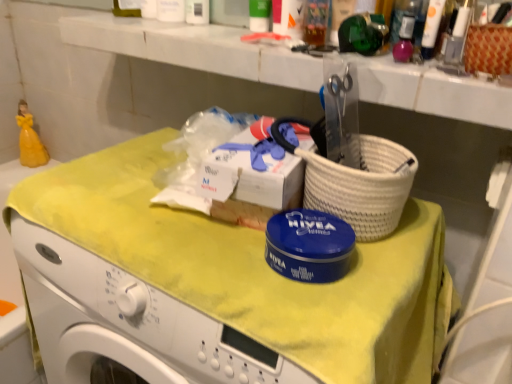
The width and height of the screenshot is (512, 384). Find the location of `white plastic container at upper center, which is counted as the first toiletry, starting from the back`. white plastic container at upper center, which is counted as the first toiletry, starting from the back is located at coordinates (197, 12).

The width and height of the screenshot is (512, 384). What do you see at coordinates (194, 48) in the screenshot?
I see `white glossy counter top at upper center` at bounding box center [194, 48].

Find the location of `white plastic container at upper center, placed as the 3th toiletry when sorted from front to back`. white plastic container at upper center, placed as the 3th toiletry when sorted from front to back is located at coordinates (197, 12).

Could you tell me if white glossy counter top at upper center is facing translucent plastic cup at upper center, the 2th toiletry viewed from the left?

No, white glossy counter top at upper center is not facing towards translucent plastic cup at upper center, the 2th toiletry viewed from the left.

Between point (118, 35) and point (326, 6), which one is positioned in front?

The point (326, 6) is in front.

Does white glossy counter top at upper center have a greater height compared to translucent plastic cup at upper center, the 2th toiletry viewed from the left?

No.

Considering the relative sizes of woven brown basket at upper right and white glossy tube at upper right, the 1th toiletry when ordered from right to left, in the image provided, is woven brown basket at upper right bigger than white glossy tube at upper right, the 1th toiletry when ordered from right to left,?

Correct, woven brown basket at upper right is larger in size than white glossy tube at upper right, the 1th toiletry when ordered from right to left.

How far apart are woven brown basket at upper right and white glossy tube at upper right, acting as the first toiletry starting from the front?

The distance of woven brown basket at upper right from white glossy tube at upper right, acting as the first toiletry starting from the front, is 3.56 inches.

Is woven brown basket at upper right far from white glossy tube at upper right, the 1th toiletry when ordered from right to left?

That's not correct — woven brown basket at upper right is a little close to white glossy tube at upper right, the 1th toiletry when ordered from right to left.

From the image's perspective, which toiletry is the 1st one above the woven brown basket at upper right? Please provide its 2D coordinates.

[(431, 27)]

Does white glossy tube at upper right, the 3th toiletry in the left-to-right sequence, come in front of woven brown basket at upper right?

No.

From a real-world perspective, which object stands above the other?

In real-world perspective, woven brown basket at upper right is above.

Can you confirm if white glossy tube at upper right, acting as the first toiletry starting from the front, is taller than woven brown basket at upper right?

Incorrect, the height of white glossy tube at upper right, acting as the first toiletry starting from the front, is not larger of that of woven brown basket at upper right.

Could you measure the distance between white glossy tube at upper right, acting as the first toiletry starting from the front, and woven brown basket at upper right?

3.56 inches.

Is yellow fabric at center taller or shorter than white glossy tube at upper right, which is counted as the 3th toiletry, starting from the back?

yellow fabric at center is taller than white glossy tube at upper right, which is counted as the 3th toiletry, starting from the back.

Does yellow fabric at center appear on the left side of white glossy tube at upper right, which is counted as the 3th toiletry, starting from the back?

Correct, you'll find yellow fabric at center to the left of white glossy tube at upper right, which is counted as the 3th toiletry, starting from the back.

From the image's perspective, is yellow fabric at center located above white glossy tube at upper right, the 3th toiletry in the left-to-right sequence?

Incorrect, from the image's perspective, yellow fabric at center is lower than white glossy tube at upper right, the 3th toiletry in the left-to-right sequence.

From the picture: How much distance is there between yellow fabric at center and white glossy tube at upper right, the 1th toiletry when ordered from right to left?

yellow fabric at center and white glossy tube at upper right, the 1th toiletry when ordered from right to left, are 45.28 centimeters apart from each other.

Is yellow fabric at center positioned beyond the bounds of white plastic container at upper center, marked as the first toiletry in a left-to-right arrangement?

Indeed, yellow fabric at center is completely outside white plastic container at upper center, marked as the first toiletry in a left-to-right arrangement.

Considering the positions of objects yellow fabric at center and white plastic container at upper center, marked as the first toiletry in a left-to-right arrangement, in the image provided, who is behind, yellow fabric at center or white plastic container at upper center, marked as the first toiletry in a left-to-right arrangement,?

white plastic container at upper center, marked as the first toiletry in a left-to-right arrangement, is behind.

Between yellow fabric at center and white plastic container at upper center, which is counted as the first toiletry, starting from the back, which one has smaller size?

Smaller between the two is white plastic container at upper center, which is counted as the first toiletry, starting from the back.

Considering the points (110, 211) and (193, 3), which point is in front, point (110, 211) or point (193, 3)?

Positioned in front is point (110, 211).

Between white glossy counter top at upper center and white glossy tube at upper right, the 3th toiletry in the left-to-right sequence, which one is positioned in front?

white glossy counter top at upper center.

From the image's perspective, would you say white glossy counter top at upper center is shown under white glossy tube at upper right, acting as the first toiletry starting from the front?

Incorrect, from the image's perspective, white glossy counter top at upper center is higher than white glossy tube at upper right, acting as the first toiletry starting from the front.

From a real-world perspective, is white glossy counter top at upper center beneath white glossy tube at upper right, which is counted as the 3th toiletry, starting from the back?

Yes.

Is white glossy counter top at upper center next to white glossy tube at upper right, the 3th toiletry in the left-to-right sequence?

No, white glossy counter top at upper center is not in contact with white glossy tube at upper right, the 3th toiletry in the left-to-right sequence.

Is point (315, 23) positioned after point (69, 33)?

No, it is not.

Is translucent plastic cup at upper center, the 2th toiletry in the front-to-back sequence, positioned in front of white glossy counter top at upper center?

That is False.

Is translucent plastic cup at upper center, the second toiletry viewed from the right, thinner than white glossy counter top at upper center?

Correct, the width of translucent plastic cup at upper center, the second toiletry viewed from the right, is less than that of white glossy counter top at upper center.

Considering the relative sizes of translucent plastic cup at upper center, which ranks as the second toiletry in back-to-front order, and white glossy counter top at upper center in the image provided, is translucent plastic cup at upper center, which ranks as the second toiletry in back-to-front order, bigger than white glossy counter top at upper center?

No, translucent plastic cup at upper center, which ranks as the second toiletry in back-to-front order, is not bigger than white glossy counter top at upper center.

Identify the location of counter top below the translucent plastic cup at upper center, which ranks as the second toiletry in back-to-front order (from the image's perspective). (194, 48).

Where is `basket in front of the white glossy tube at upper right, the 1th toiletry when ordered from right to left`? basket in front of the white glossy tube at upper right, the 1th toiletry when ordered from right to left is located at coordinates (488, 49).

Estimate the real-world distances between objects in this image. Which object is further from translucent plastic cup at upper center, the 2th toiletry in the front-to-back sequence, woven brown basket at upper right or white plastic container at upper center, which appears as the 3th toiletry when viewed from the right?

woven brown basket at upper right lies further to translucent plastic cup at upper center, the 2th toiletry in the front-to-back sequence, than the other object.

Based on their spatial positions, is white plastic container at upper center, placed as the 3th toiletry when sorted from front to back, or translucent plastic cup at upper center, the 2th toiletry in the front-to-back sequence, further from white glossy tube at upper right, acting as the first toiletry starting from the front?

Based on the image, white plastic container at upper center, placed as the 3th toiletry when sorted from front to back, appears to be further to white glossy tube at upper right, acting as the first toiletry starting from the front.

When comparing their distances from yellow fabric at center, does woven brown basket at upper right or white glossy tube at upper right, which is counted as the 3th toiletry, starting from the back, seem closer?

woven brown basket at upper right is positioned closer to the anchor yellow fabric at center.

Looking at the image, which one is located closer to white glossy tube at upper right, acting as the first toiletry starting from the front, white glossy counter top at upper center or white plastic container at upper center, which is counted as the first toiletry, starting from the back?

white glossy counter top at upper center.

From the image, which object appears to be farther from white glossy tube at upper right, which is counted as the 3th toiletry, starting from the back, yellow fabric at center or white plastic container at upper center, which appears as the 3th toiletry when viewed from the right?

white plastic container at upper center, which appears as the 3th toiletry when viewed from the right, is further to white glossy tube at upper right, which is counted as the 3th toiletry, starting from the back.

Looking at the image, which one is located further to white glossy counter top at upper center, white plastic container at upper center, marked as the first toiletry in a left-to-right arrangement, or woven brown basket at upper right?

woven brown basket at upper right.

From the image, which object appears to be nearer to woven brown basket at upper right, translucent plastic cup at upper center, which ranks as the second toiletry in back-to-front order, or white glossy tube at upper right, the 1th toiletry when ordered from right to left?

white glossy tube at upper right, the 1th toiletry when ordered from right to left, is closer to woven brown basket at upper right.

Considering their positions, is white glossy counter top at upper center positioned further to white glossy tube at upper right, the 3th toiletry in the left-to-right sequence, than translucent plastic cup at upper center, the 2th toiletry in the front-to-back sequence?

white glossy counter top at upper center.

Where is `counter top situated between white plastic container at upper center, placed as the 3th toiletry when sorted from front to back, and white glossy tube at upper right, the 1th toiletry when ordered from right to left, from left to right`? counter top situated between white plastic container at upper center, placed as the 3th toiletry when sorted from front to back, and white glossy tube at upper right, the 1th toiletry when ordered from right to left, from left to right is located at coordinates (194, 48).

This screenshot has height=384, width=512. What are the coordinates of `counter top between white plastic container at upper center, which appears as the 3th toiletry when viewed from the right, and yellow fabric at center vertically` in the screenshot? It's located at (194, 48).

Where is `basket between white glossy counter top at upper center and yellow fabric at center in the vertical direction`? This screenshot has height=384, width=512. basket between white glossy counter top at upper center and yellow fabric at center in the vertical direction is located at coordinates (488, 49).

Find the location of a particular element. toiletry between white glossy counter top at upper center and yellow fabric at center in the vertical direction is located at coordinates (431, 27).